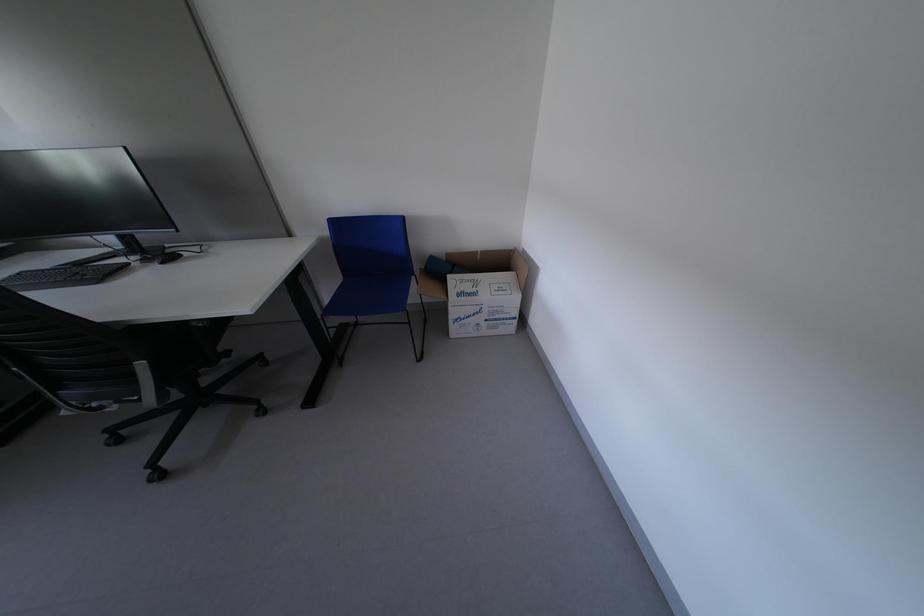
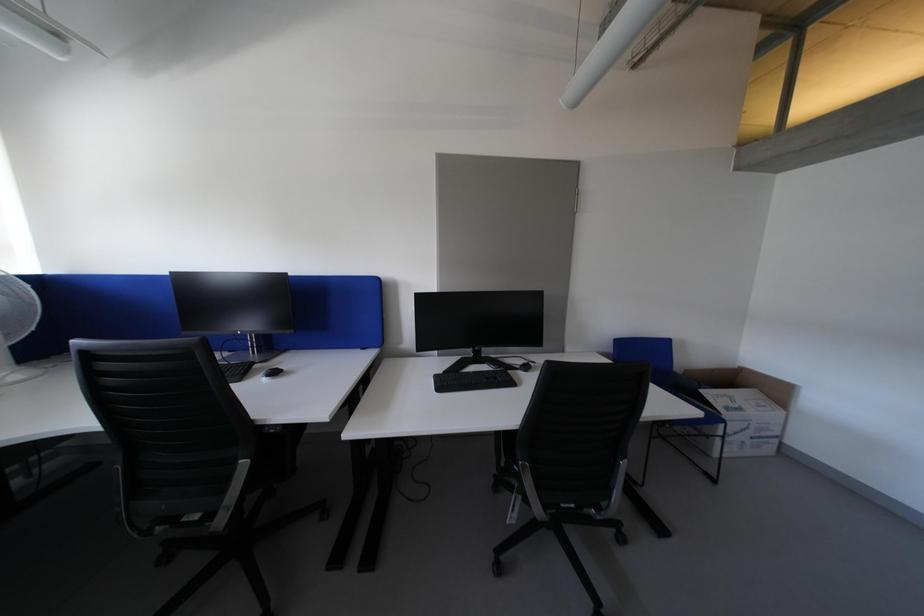
Question: The images are taken continuously from a first-person perspective. In which direction are you moving?

Choices:
 (A) Left
 (B) Right
 (C) Forward
 (D) Backward

Answer: (A)